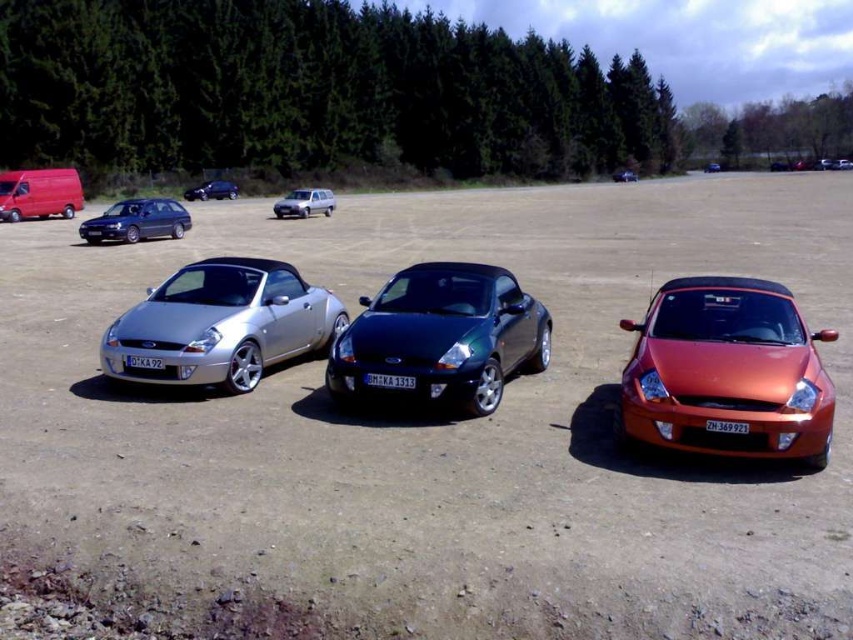
Can you confirm if glossy dark green convertible at center is positioned below satin black sedan at upper left?

Yes, glossy dark green convertible at center is below satin black sedan at upper left.

Can you confirm if glossy dark green convertible at center is taller than satin black sedan at upper left?

No.

Is point (505, 310) more distant than point (206, 188)?

No, it is not.

Locate an element on the screen. glossy dark green convertible at center is located at coordinates (440, 339).

Which is above, satin black sedan at upper left or glossy metallic car at center?

Positioned higher is glossy metallic car at center.

Consider the image. Is satin black sedan at upper left bigger than glossy metallic car at center?

No.

The image size is (853, 640). I want to click on satin black sedan at upper left, so click(212, 189).

Who is more distant from viewer, (19, 195) or (619, 170)?

The point (619, 170) is behind.

What are the coordinates of `matte red van at upper left` in the screenshot? It's located at (39, 193).

Where is `matte red van at upper left`? This screenshot has height=640, width=853. matte red van at upper left is located at coordinates (39, 193).